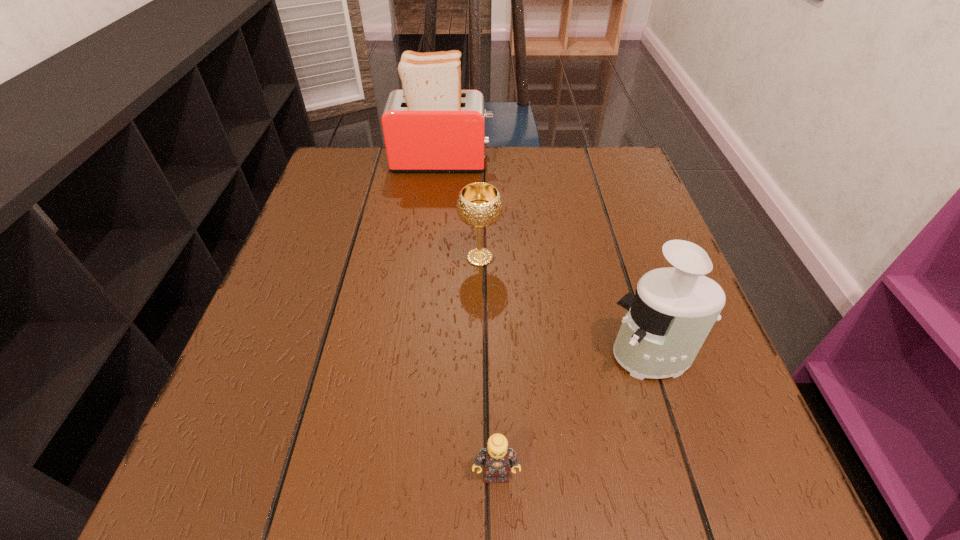
The height and width of the screenshot is (540, 960). Identify the location of blank area in the image that satisfies the following two spatial constraints: 1. on the front-facing side of the toaster; 2. on the back side of the third nearest object. (432, 258).

At what (x,y) coordinates should I click in order to perform the action: click on vacant space that satisfies the following two spatial constraints: 1. on the front-facing side of the toaster; 2. on the left side of the third tallest object. Please return your answer as a coordinate pair (x, y). Looking at the image, I should click on (432, 258).

Find the location of a particular element. The height and width of the screenshot is (540, 960). vacant space that satisfies the following two spatial constraints: 1. on the front-facing side of the third farthest object; 2. on the right side of the farthest object is located at coordinates (420, 356).

Where is `free region that satisfies the following two spatial constraints: 1. on the front-facing side of the toaster; 2. on the right side of the rightmost object`? free region that satisfies the following two spatial constraints: 1. on the front-facing side of the toaster; 2. on the right side of the rightmost object is located at coordinates (420, 356).

Identify the location of vacant area in the image that satisfies the following two spatial constraints: 1. on the back side of the second farthest object; 2. on the front-facing side of the toaster. (480, 161).

Locate an element on the screen. The height and width of the screenshot is (540, 960). vacant space that satisfies the following two spatial constraints: 1. on the front-facing side of the farthest object; 2. on the right side of the third farthest object is located at coordinates (420, 356).